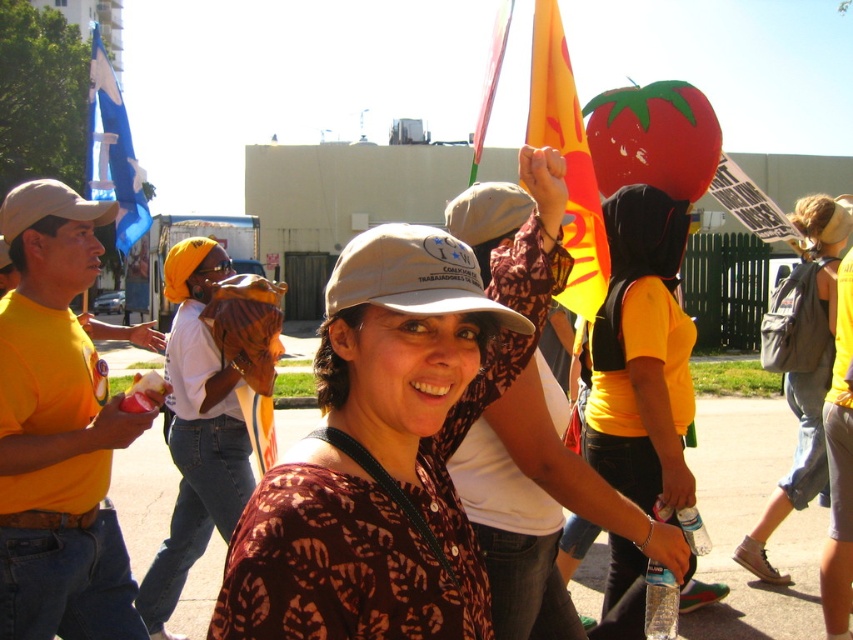
Question: Observing the image, what is the correct spatial positioning of matte yellow shirt at center in reference to yellow fabric flag at upper center?

Choices:
 (A) right
 (B) left

Answer: (B)

Question: Is inflatable red tomato at upper right above yellow fabric flag at upper center?

Choices:
 (A) no
 (B) yes

Answer: (B)

Question: Which object appears farthest from the camera in this image?

Choices:
 (A) matte yellow shirt at center
 (B) white fabric baseball cap at center

Answer: (A)

Question: Can you confirm if yellow t-shirt at left is positioned to the right of yellow matte shirt at center?

Choices:
 (A) no
 (B) yes

Answer: (A)

Question: Which point is closer to the camera taking this photo?

Choices:
 (A) (469, 304)
 (B) (422, 522)
 (C) (635, 113)
 (D) (44, 182)

Answer: (A)

Question: Which object is positioned farthest from the white fabric baseball cap at center?

Choices:
 (A) blue fabric flag at upper left
 (B) beige fabric baseball cap at left
 (C) yellow matte shirt at center

Answer: (A)